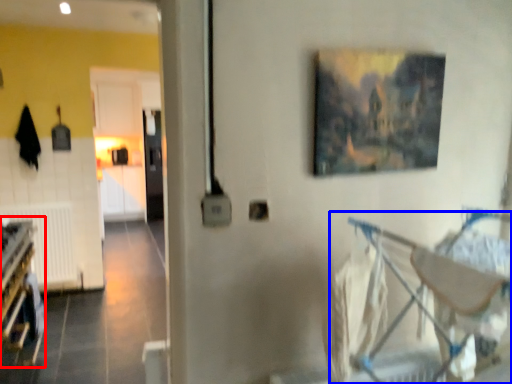
Question: Which of the following is the closest to the observer, bunk bed (highlighted by a red box) or baby carriage (highlighted by a blue box)?

Choices:
 (A) bunk bed
 (B) baby carriage

Answer: (B)